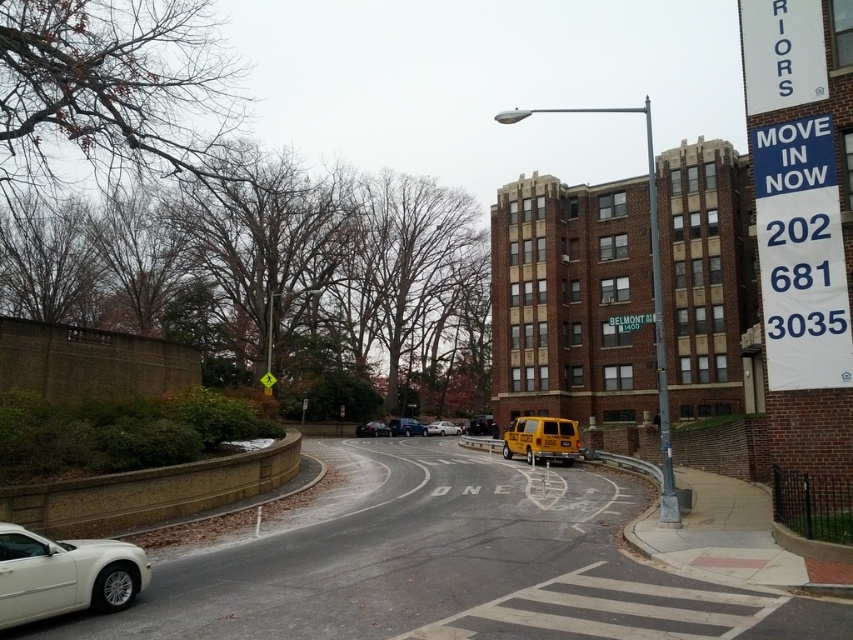
Who is positioned more to the left, yellow matte school bus at center or silver metallic sedan at center?

From the viewer's perspective, silver metallic sedan at center appears more on the left side.

Can you confirm if yellow matte school bus at center is positioned below silver metallic sedan at center?

No.

Does point (566, 464) lie in front of point (454, 428)?

Yes.

You are a GUI agent. You are given a task and a screenshot of the screen. Output one action in this format:
    pyautogui.click(x=<x>, y=<y>)
    Task: Click on the yellow matte school bus at center
    The width and height of the screenshot is (853, 640).
    Given the screenshot: What is the action you would take?
    pyautogui.click(x=541, y=440)

Is point (109, 568) more distant than point (425, 432)?

No, it is in front of (425, 432).

Is white glossy sedan at lower left below matte blue sedan at center?

Actually, white glossy sedan at lower left is above matte blue sedan at center.

This screenshot has height=640, width=853. In order to click on white glossy sedan at lower left in this screenshot , I will do `click(64, 573)`.

What are the coordinates of `white glossy sedan at lower left` in the screenshot? It's located at (64, 573).

Between metallic silver car at center and silver metallic sedan at center, which one appears on the left side from the viewer's perspective?

From the viewer's perspective, metallic silver car at center appears more on the left side.

Who is more forward, (368, 433) or (432, 426)?

Point (368, 433) is in front.

Locate an element on the screen. The width and height of the screenshot is (853, 640). metallic silver car at center is located at coordinates (372, 428).